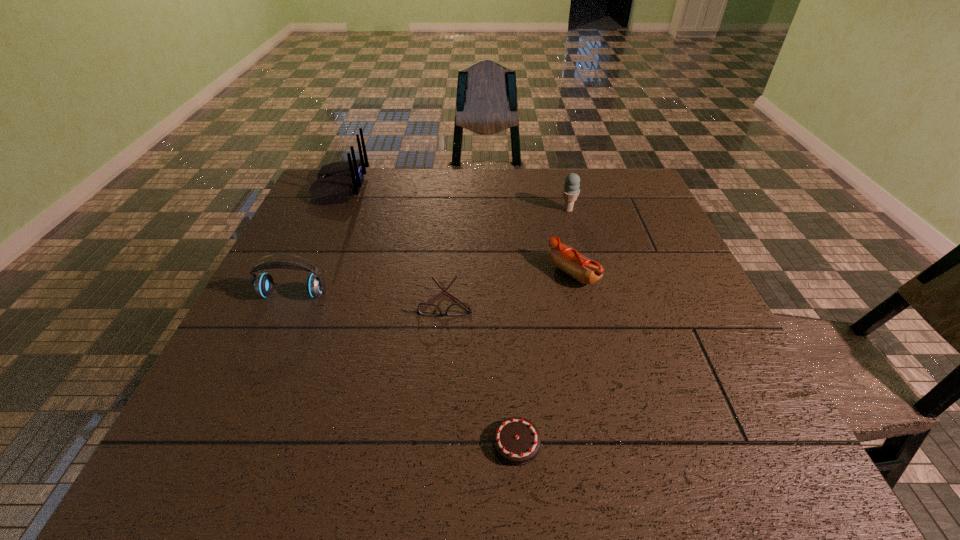
Locate an element on the screen. Image resolution: width=960 pixels, height=540 pixels. free region at the far edge is located at coordinates (477, 199).

Image resolution: width=960 pixels, height=540 pixels. In order to click on free space at the left edge of the desktop in this screenshot , I will do `click(322, 237)`.

Locate an element on the screen. free space at the right edge of the desktop is located at coordinates (677, 266).

In the image, there is a desktop. In order to click on vacant space at the far right corner in this screenshot , I will do `click(609, 196)`.

Where is `vacant region between the ice cream and the spectacles`? This screenshot has width=960, height=540. vacant region between the ice cream and the spectacles is located at coordinates (507, 255).

In order to click on vacant space in between the fourth object from left to right and the fifth tallest object in this screenshot , I will do `click(481, 372)`.

At what (x,y) coordinates should I click in order to perform the action: click on free space between the ice cream and the sausage. Please return your answer as a coordinate pair (x, y). This screenshot has height=540, width=960. Looking at the image, I should click on (570, 241).

Where is `free spot between the headset and the ice cream`? The image size is (960, 540). free spot between the headset and the ice cream is located at coordinates (431, 252).

Find the location of `empty space that is in between the tallest object and the third object from left to right`. empty space that is in between the tallest object and the third object from left to right is located at coordinates click(393, 244).

What are the coordinates of `vacant space in between the third shortest object and the ice cream` in the screenshot? It's located at (570, 241).